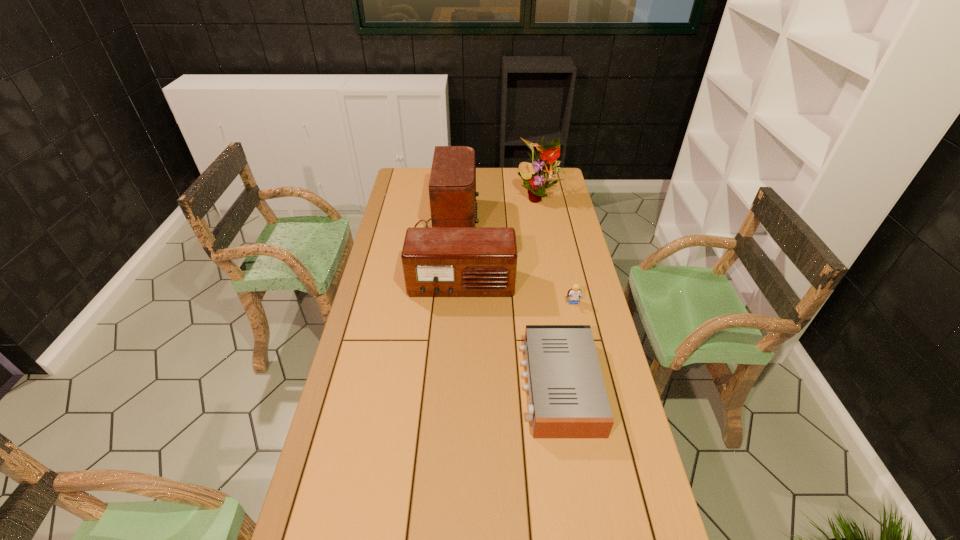
Locate an element on the screen. vacant space located on the front-facing side of the Lego is located at coordinates (590, 382).

Where is `vacant space situated 0.230m on the control panel of the nearest object`? This screenshot has height=540, width=960. vacant space situated 0.230m on the control panel of the nearest object is located at coordinates (448, 386).

Locate an element on the screen. The height and width of the screenshot is (540, 960). vacant space situated on the control panel of the nearest object is located at coordinates (426, 386).

This screenshot has width=960, height=540. What are the coordinates of `vacant space situated 0.210m on the control panel of the nearest object` in the screenshot? It's located at (455, 386).

Image resolution: width=960 pixels, height=540 pixels. I want to click on object that is at the far edge, so tap(540, 172).

Where is `bouquet located at the right edge`? The height and width of the screenshot is (540, 960). bouquet located at the right edge is located at coordinates (540, 172).

At what (x,y) coordinates should I click in order to perform the action: click on Lego that is at the right edge. Please return your answer as a coordinate pair (x, y). Looking at the image, I should click on (574, 293).

Locate an element on the screen. This screenshot has height=540, width=960. radio receiver situated at the right edge is located at coordinates (568, 399).

Identify the location of object situated at the far right corner. This screenshot has width=960, height=540. (540, 172).

The image size is (960, 540). Find the location of `free space at the far edge of the desktop`. free space at the far edge of the desktop is located at coordinates (496, 182).